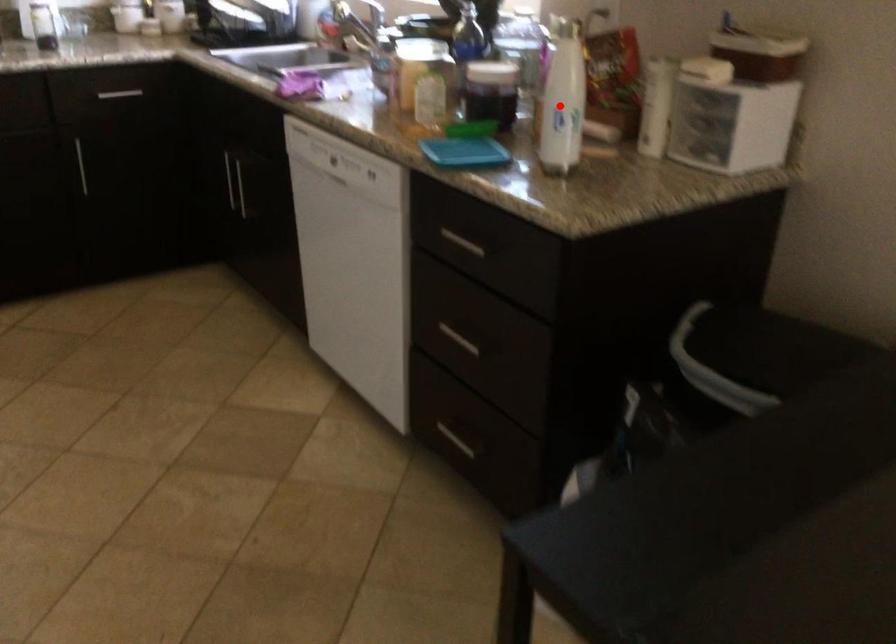
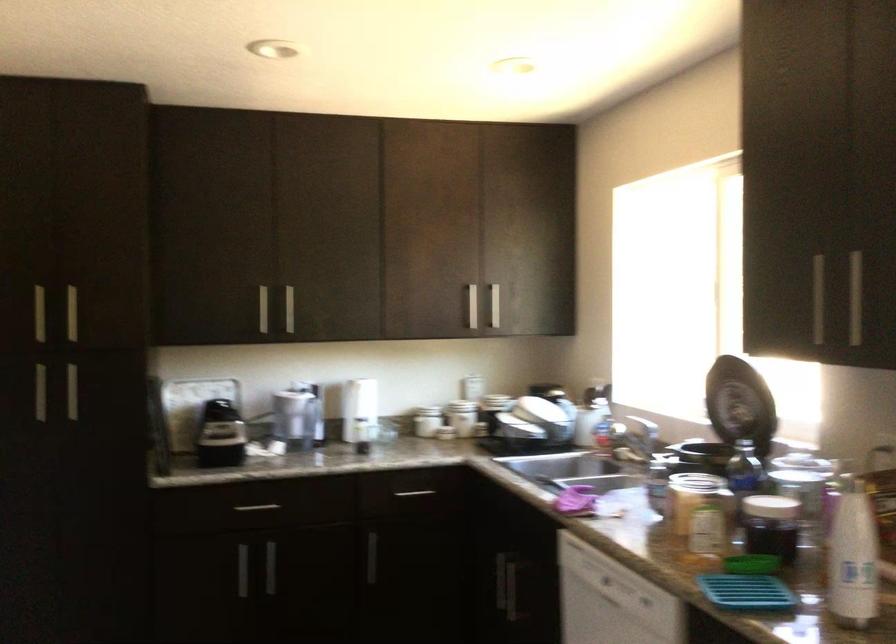
Where in the second image is the point corresponding to the highlighted location from the first image?

(853, 556)